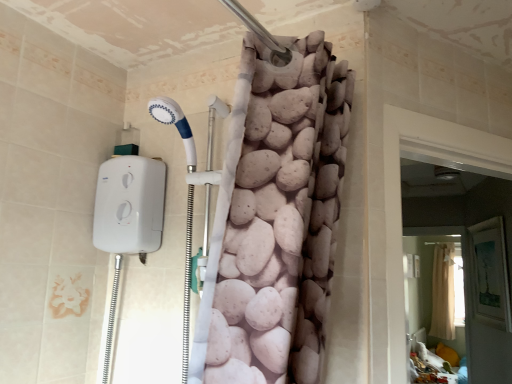
Question: Based on their positions, is beige fabric shower curtain at upper center located to the left or right of white fabric screen door at right, placed as the 1th screen door when sorted from front to back?

Choices:
 (A) left
 (B) right

Answer: (B)

Question: Considering the positions of point (437, 337) and point (497, 173), is point (437, 337) closer or farther from the camera than point (497, 173)?

Choices:
 (A) closer
 (B) farther

Answer: (B)

Question: Which object is positioned closest to the white fabric screen door at right, the 2th screen door from the back?

Choices:
 (A) beige fabric shower curtain at upper center
 (B) beige fabric screen door at lower right, which appears as the second screen door when viewed from the left

Answer: (B)

Question: Which of these objects is positioned farthest from the beige fabric shower curtain at upper center?

Choices:
 (A) white fabric screen door at right, placed as the first screen door when sorted from left to right
 (B) beige fabric screen door at lower right, positioned as the first screen door in back-to-front order

Answer: (A)